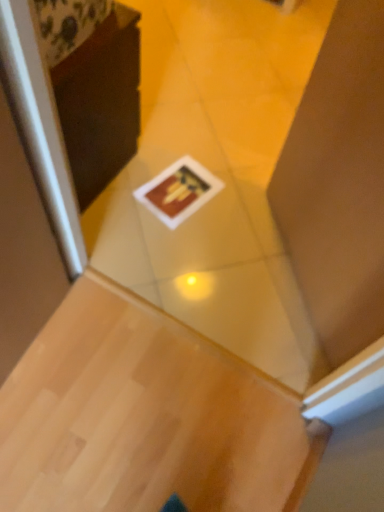
This screenshot has height=512, width=384. I want to click on free space above wooden drawer at left (from a real-world perspective), so click(89, 28).